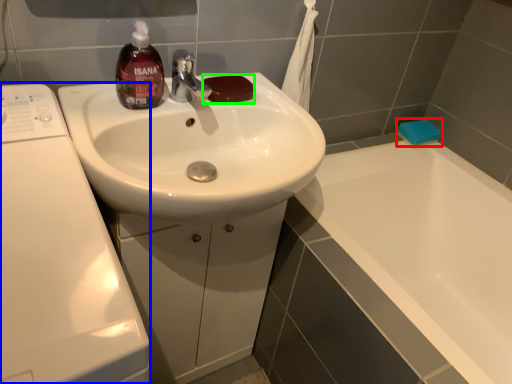
Question: Which object is the closest to the soap (highlighted by a red box)? Choose among these: washing machine (highlighted by a blue box) or soap (highlighted by a green box).

Choices:
 (A) washing machine
 (B) soap

Answer: (B)